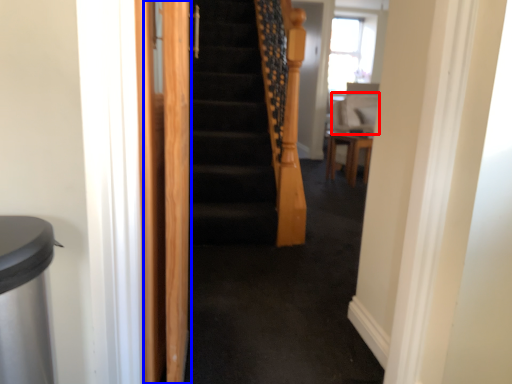
Question: Which of the following is the closest to the observer, sit (highlighted by a red box) or screen door (highlighted by a blue box)?

Choices:
 (A) sit
 (B) screen door

Answer: (B)